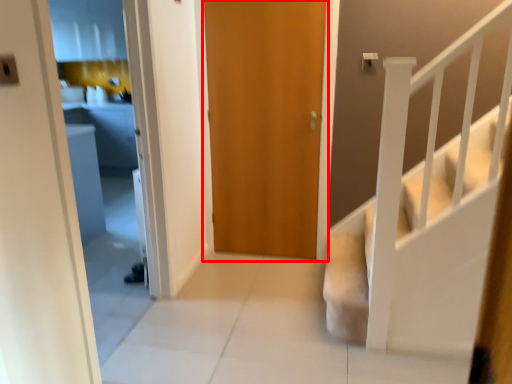
Question: From the image's perspective, considering the relative positions of door (annotated by the red box) and stairs in the image provided, where is door (annotated by the red box) located with respect to the staircase?

Choices:
 (A) above
 (B) below

Answer: (A)